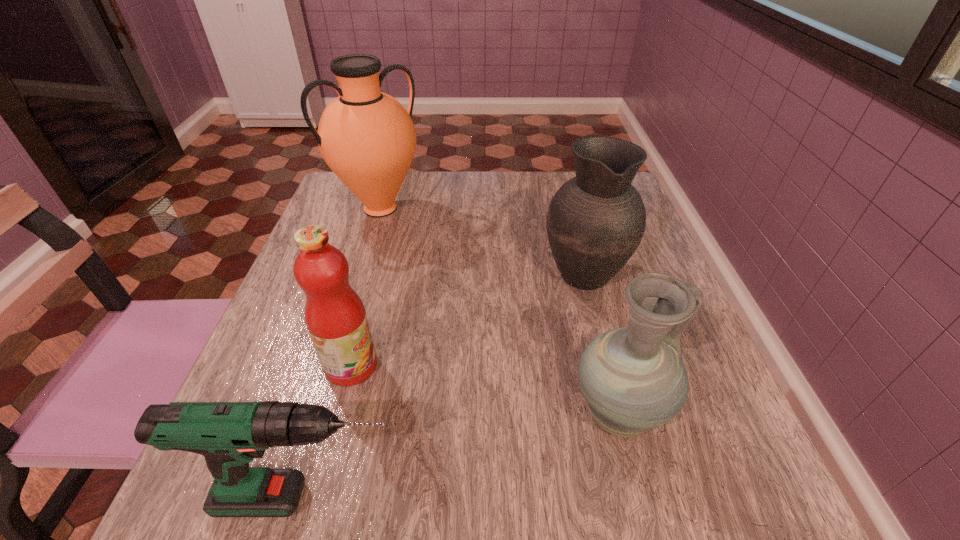
Locate an element on the screen. the farthest object is located at coordinates pos(367,138).

Find the location of a particular element. This screenshot has width=960, height=540. the tallest object is located at coordinates (367, 138).

Image resolution: width=960 pixels, height=540 pixels. I want to click on the second farthest object, so click(596, 220).

Where is `fruit juice`? fruit juice is located at coordinates (335, 316).

This screenshot has height=540, width=960. Find the location of `the nearest pitcher`. the nearest pitcher is located at coordinates (633, 378).

You are a GUI agent. You are given a task and a screenshot of the screen. Output one action in this format:
    pyautogui.click(x=<x>, y=<y>)
    Task: Click on the shortest object
    
    Given the screenshot: What is the action you would take?
    (229, 435)

What are the coordinates of `drill` in the screenshot? It's located at (229, 435).

You are a GUI agent. You are given a task and a screenshot of the screen. Output one action in this format:
    pyautogui.click(x=<x>, y=<y>)
    Task: Click on the vacant region located on the front of the farthest object
    The image size is (960, 540).
    Given the screenshot: What is the action you would take?
    pyautogui.click(x=356, y=289)

Locate an element on the screen. The height and width of the screenshot is (540, 960). free region located 0.150m on the side of the fourth nearest object with the handle is located at coordinates (566, 207).

Where is `vacant region located 0.320m on the side of the fourth nearest object with the handle`? vacant region located 0.320m on the side of the fourth nearest object with the handle is located at coordinates (558, 174).